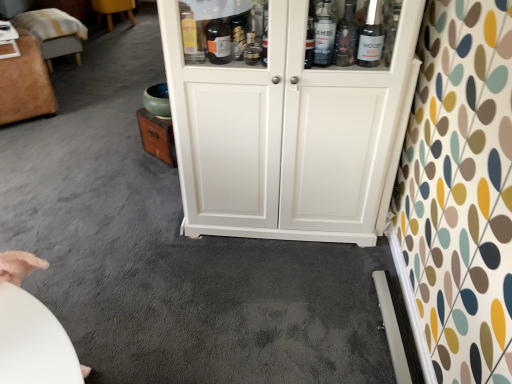
Locate an element on the screen. The width and height of the screenshot is (512, 384). free location to the left of white wood cupboard at center is located at coordinates (142, 256).